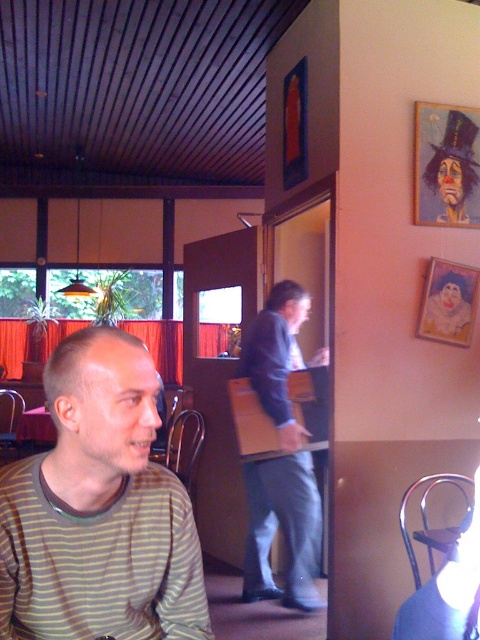
You are a customer sitting at the table in the foreground. You notice two artworks on the right wall. Which one do you think is bigger between the wooden framed portrait at upper right and the matte paper picture frame at upper right?

The wooden framed portrait at upper right is larger than the matte paper picture frame at upper right.

You are a customer sitting at the table and want to look at both the wooden framed portrait at upper right and the matte paper picture frame at upper right. Which one would you look towards if you want to see the one on the left side first?

The wooden framed portrait at upper right is positioned on the left side of matte paper picture frame at upper right, so you should look towards the wooden framed portrait at upper right first.

You are a customer entering the cafe and want to sit at the table with the dark blue suit at center. Is there enough space for you to sit next to the wooden framed portrait at upper right?

The dark blue suit at center is larger in size than the wooden framed portrait at upper right, so there might not be enough space to sit next to the wooden framed portrait at upper right.